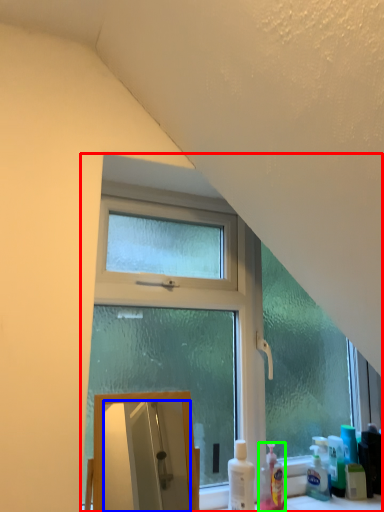
Question: Considering the real-world distances, which object is farthest from window (highlighted by a red box)? mirror (highlighted by a blue box) or cleaning product (highlighted by a green box)?

Choices:
 (A) mirror
 (B) cleaning product

Answer: (A)